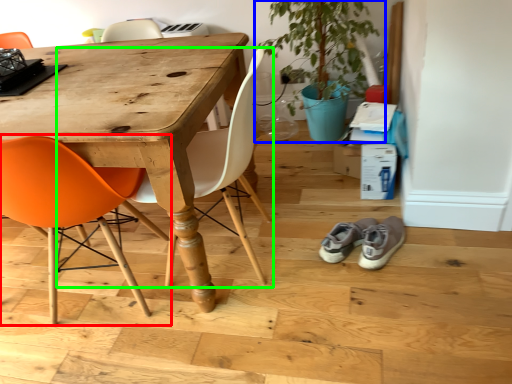
Question: Considering the real-world distances, which object is closest to chair (highlighted by a red box)? houseplant (highlighted by a blue box) or chair (highlighted by a green box).

Choices:
 (A) houseplant
 (B) chair

Answer: (B)